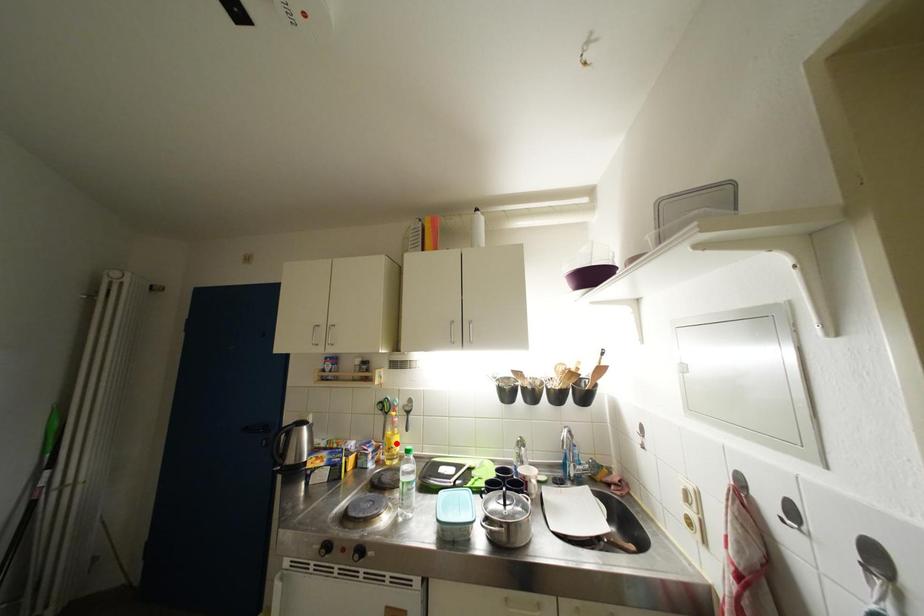
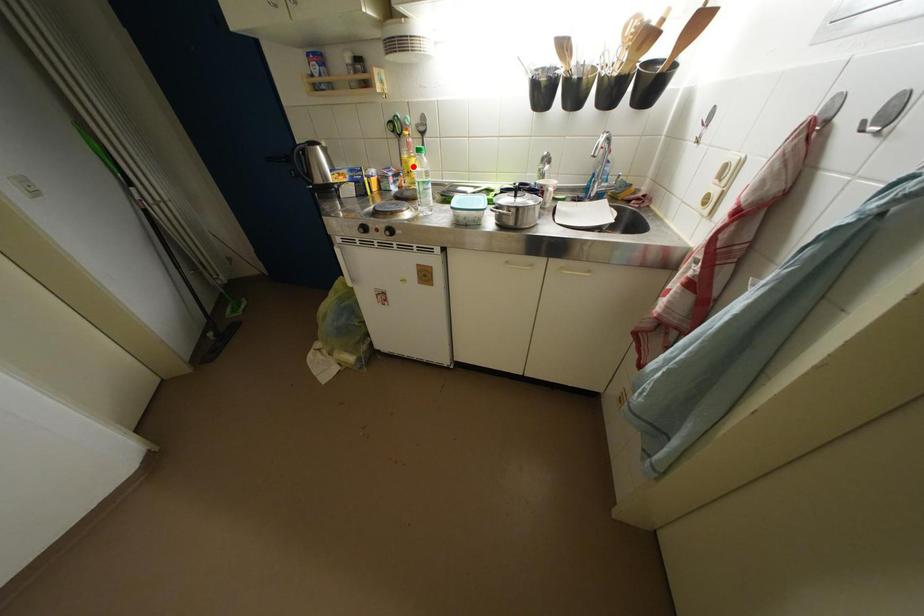
I am providing you with two images of the same scene from different viewpoints. A red point is marked on the first image and another point is marked on the second image. Is the red point in image1 aligned with the point shown in image2?

Yes